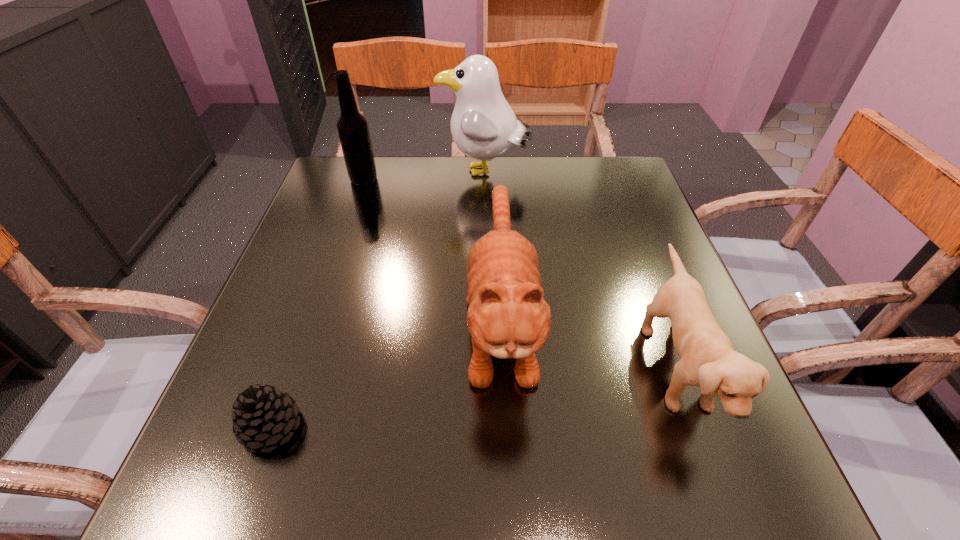
This screenshot has height=540, width=960. In order to click on object at the right edge in this screenshot , I will do `click(708, 359)`.

Where is `object situated at the far left corner`? Image resolution: width=960 pixels, height=540 pixels. object situated at the far left corner is located at coordinates (353, 130).

The height and width of the screenshot is (540, 960). In order to click on object located in the near left corner section of the desktop in this screenshot , I will do `click(264, 415)`.

Identify the location of object located in the near right corner section of the desktop. Image resolution: width=960 pixels, height=540 pixels. (708, 359).

The width and height of the screenshot is (960, 540). Find the location of `free region at the far edge`. free region at the far edge is located at coordinates (435, 192).

The width and height of the screenshot is (960, 540). I want to click on vacant position at the near edge of the desktop, so pos(583,478).

This screenshot has height=540, width=960. Identify the location of vacant space at the left edge of the desktop. (309, 345).

Where is `free region at the right edge`? This screenshot has width=960, height=540. free region at the right edge is located at coordinates (658, 347).

Locate an element on the screen. The width and height of the screenshot is (960, 540). vacant space at the far left corner is located at coordinates (381, 190).

The width and height of the screenshot is (960, 540). What are the coordinates of `vacant position at the far right corner of the desktop` in the screenshot? It's located at (594, 192).